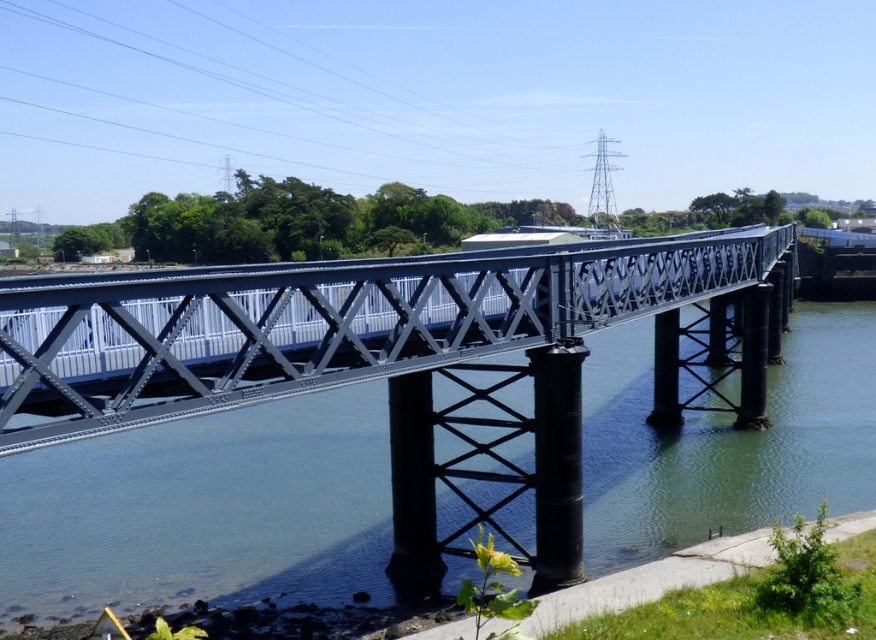
Question: Observing the image, what is the correct spatial positioning of greenish-blue water at center in reference to metallic bridge at center?

Choices:
 (A) left
 (B) right

Answer: (A)

Question: Which point appears farthest from the camera in this image?

Choices:
 (A) (518, 259)
 (B) (361, 477)

Answer: (B)

Question: Does greenish-blue water at center lie behind metallic bridge at center?

Choices:
 (A) no
 (B) yes

Answer: (B)

Question: Can you confirm if greenish-blue water at center is bigger than metallic bridge at center?

Choices:
 (A) no
 (B) yes

Answer: (A)

Question: Which point is closer to the camera?

Choices:
 (A) metallic bridge at center
 (B) greenish-blue water at center

Answer: (A)

Question: Which of the following is the closest to the observer?

Choices:
 (A) metallic bridge at center
 (B) greenish-blue water at center

Answer: (A)